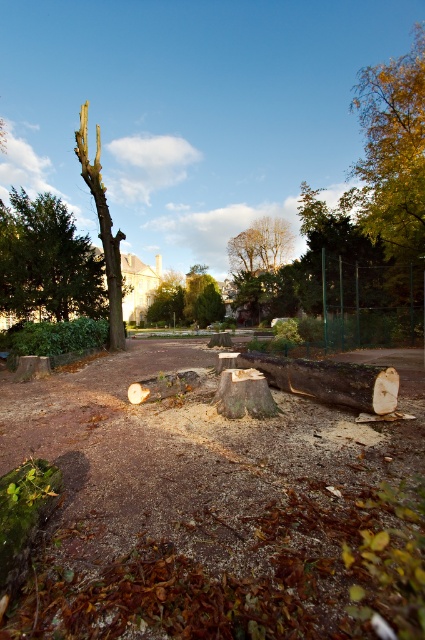
Question: Estimate the real-world distances between objects in this image. Which object is closer to the brown rough wood log at center?

Choices:
 (A) smooth brown tree trunk at left
 (B) green leafy tree at center
 (C) green matte tree at upper left

Answer: (C)

Question: Which object is positioned closest to the brown rough wood log at center?

Choices:
 (A) green matte tree at upper left
 (B) green leafy tree at center
 (C) smooth brown tree trunk at left

Answer: (A)

Question: Which of these objects is positioned closest to the green matte tree at upper left?

Choices:
 (A) smooth brown tree trunk at left
 (B) brown rough wood log at center
 (C) green leafy tree at center

Answer: (A)

Question: Is brown rough wood log at center closer to camera compared to smooth brown tree trunk at left?

Choices:
 (A) yes
 (B) no

Answer: (A)

Question: From the image, what is the correct spatial relationship of brown rough wood log at center in relation to smooth brown tree trunk at left?

Choices:
 (A) left
 (B) right

Answer: (B)

Question: Considering the relative positions of green matte tree at upper left and brown rough wood log at center in the image provided, where is green matte tree at upper left located with respect to brown rough wood log at center?

Choices:
 (A) left
 (B) right

Answer: (A)